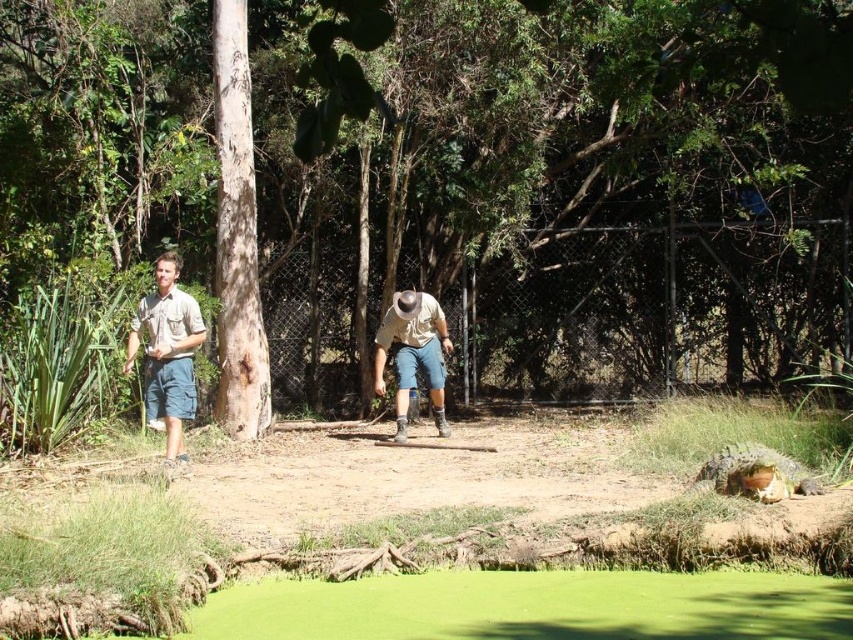
Does khaki cotton shirt at center appear under khaki cotton shirt at left?

No.

Between khaki cotton shirt at center and khaki cotton shirt at left, which one is positioned lower?

khaki cotton shirt at left is below.

Is point (164, 348) farther from camera compared to point (169, 300)?

That is False.

Find the location of a particular element. khaki cotton shirt at center is located at coordinates click(167, 349).

Describe the element at coordinates (169, 348) in the screenshot. I see `khaki cotton shirt at left` at that location.

What do you see at coordinates (169, 348) in the screenshot?
I see `khaki cotton shirt at left` at bounding box center [169, 348].

Where is `khaki cotton shirt at left`? Image resolution: width=853 pixels, height=640 pixels. khaki cotton shirt at left is located at coordinates (169, 348).

Is brown rough tree at center positioned at the back of khaki cotton shirt at center?

No, it is in front of khaki cotton shirt at center.

Is point (357, 58) closer to camera compared to point (161, 257)?

No, it is not.

The width and height of the screenshot is (853, 640). Find the location of `brown rough tree at center`. brown rough tree at center is located at coordinates (408, 116).